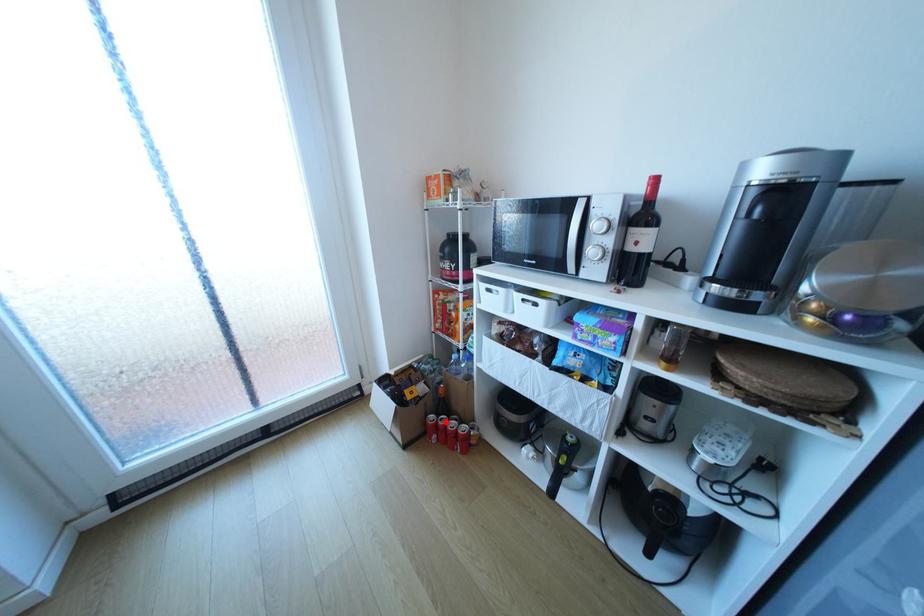
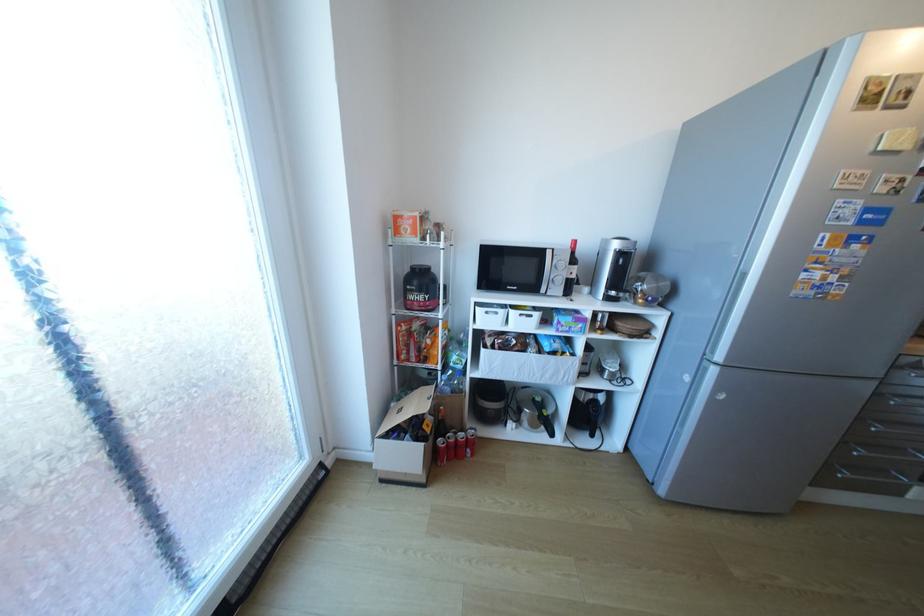
Question: I am providing you with two images of the same scene from different viewpoints. Image1 has a red point marked. In image2, the corresponding 3D location appears at what relative position? Reply with the corresponding letter.

Choices:
 (A) Closer
 (B) Farther

Answer: (A)